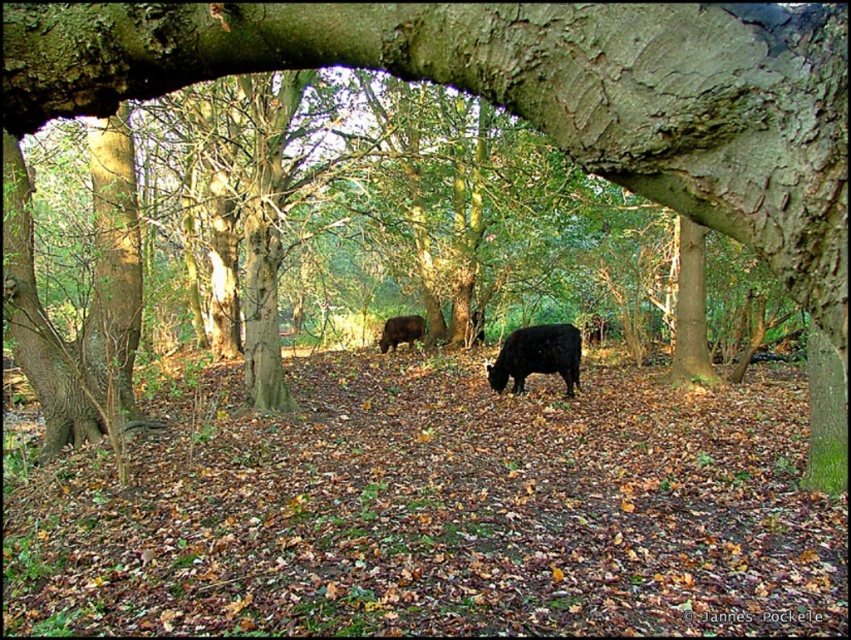
Does black glossy cow at center have a lesser height compared to shiny brown cow at center?

No.

Is black glossy cow at center positioned before shiny brown cow at center?

Yes, black glossy cow at center is in front of shiny brown cow at center.

Describe the element at coordinates (537, 356) in the screenshot. The image size is (851, 640). I see `black glossy cow at center` at that location.

Identify the location of black glossy cow at center. (537, 356).